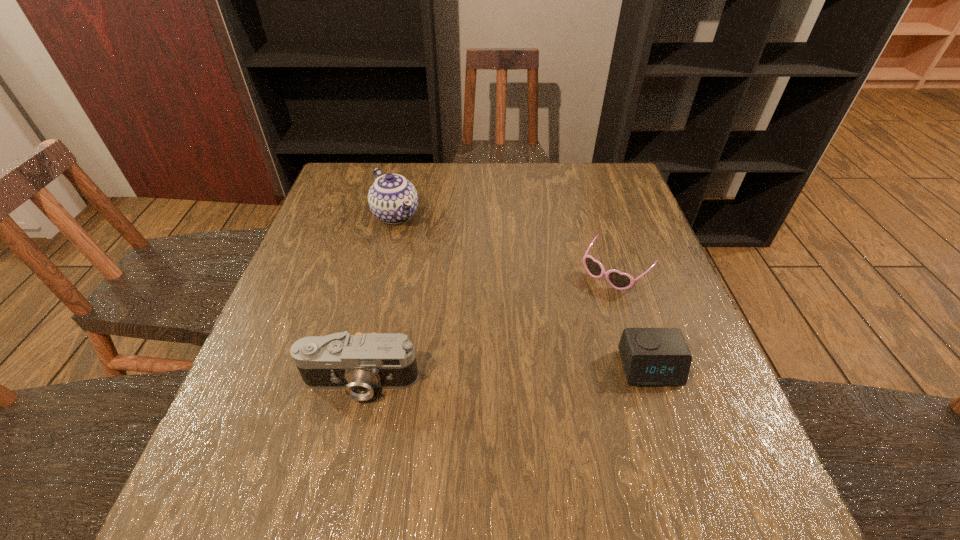
Locate an element on the screen. Image resolution: width=960 pixels, height=540 pixels. object that is positioned at the far left corner is located at coordinates (393, 199).

At what (x,y) coordinates should I click in order to perform the action: click on object that is at the near left corner. Please return your answer as a coordinate pair (x, y). This screenshot has height=540, width=960. Looking at the image, I should click on (359, 363).

Where is `free space at the far edge of the desktop`? free space at the far edge of the desktop is located at coordinates (482, 170).

Find the location of a particular element. Image resolution: width=960 pixels, height=540 pixels. vacant space at the near edge of the desktop is located at coordinates (615, 421).

This screenshot has height=540, width=960. In the image, there is a desktop. What are the coordinates of `free space at the left edge` in the screenshot? It's located at (266, 332).

You are a GUI agent. You are given a task and a screenshot of the screen. Output one action in this format:
    pyautogui.click(x=<x>, y=<y>)
    Task: Click on the vacant space at the right edge of the desktop
    The height and width of the screenshot is (540, 960).
    Given the screenshot: What is the action you would take?
    pyautogui.click(x=629, y=291)

This screenshot has width=960, height=540. What are the coordinates of `vacant space at the far left corner of the desktop` in the screenshot? It's located at (364, 175).

In the image, there is a desktop. Identify the location of vacant space at the near left corner. (301, 438).

The image size is (960, 540). In the image, there is a desktop. What are the coordinates of `vacant area at the far right corner` in the screenshot? It's located at (603, 180).

Find the location of a particular element. The height and width of the screenshot is (540, 960). unoccupied area between the shortest object and the second tallest object is located at coordinates (488, 327).